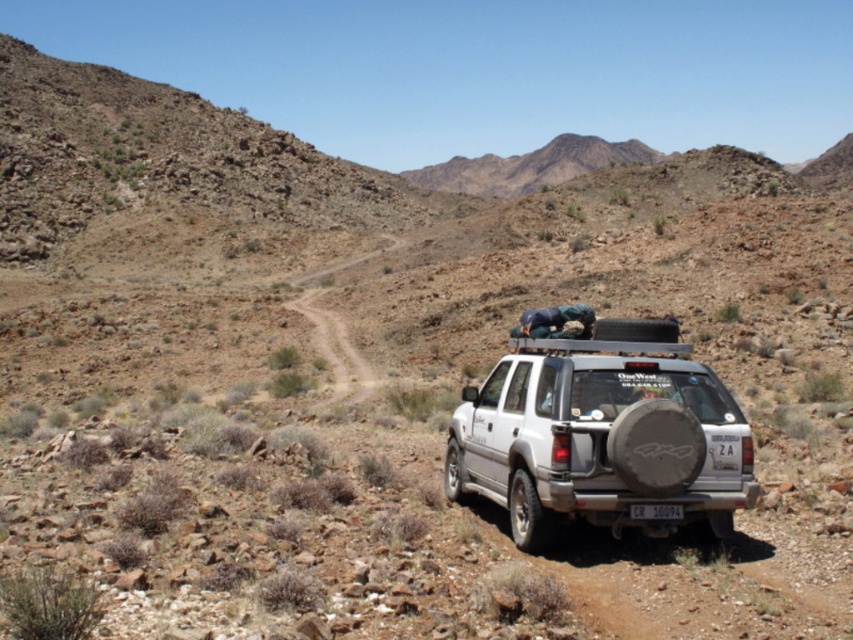
Question: Which object appears closest to the camera in this image?

Choices:
 (A) white plastic license plate at rear
 (B) silver metallic suv at center

Answer: (B)

Question: Can you confirm if silver metallic suv at center is positioned below white plastic license plate at rear?

Choices:
 (A) yes
 (B) no

Answer: (B)

Question: Does silver metallic suv at center have a larger size compared to white plastic license plate at rear?

Choices:
 (A) no
 (B) yes

Answer: (B)

Question: Can you confirm if silver metallic suv at center is wider than white plastic license plate at rear?

Choices:
 (A) yes
 (B) no

Answer: (A)